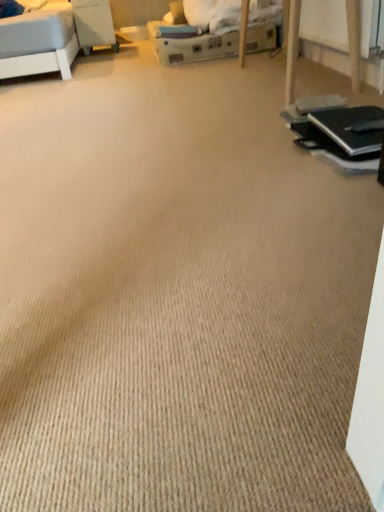
Question: Are wooden table at upper left and black matte laptop at right making contact?

Choices:
 (A) no
 (B) yes

Answer: (A)

Question: Considering the relative sizes of wooden table at upper left and black matte laptop at right in the image provided, is wooden table at upper left smaller than black matte laptop at right?

Choices:
 (A) yes
 (B) no

Answer: (B)

Question: Would you consider wooden table at upper left to be distant from black matte laptop at right?

Choices:
 (A) yes
 (B) no

Answer: (A)

Question: Is wooden table at upper left to the left of black matte laptop at right from the viewer's perspective?

Choices:
 (A) yes
 (B) no

Answer: (A)

Question: From a real-world perspective, does wooden table at upper left sit lower than black matte laptop at right?

Choices:
 (A) no
 (B) yes

Answer: (A)

Question: Is wooden table at upper left in front of black matte laptop at right?

Choices:
 (A) yes
 (B) no

Answer: (B)

Question: Does black matte laptop at right have a greater width compared to wooden table at upper left?

Choices:
 (A) yes
 (B) no

Answer: (B)

Question: From the image's perspective, is black matte laptop at right located beneath wooden table at upper left?

Choices:
 (A) yes
 (B) no

Answer: (A)

Question: From a real-world perspective, is black matte laptop at right on top of wooden table at upper left?

Choices:
 (A) no
 (B) yes

Answer: (A)

Question: Could wooden table at upper left be considered to be inside black matte laptop at right?

Choices:
 (A) yes
 (B) no

Answer: (B)

Question: Does black matte laptop at right have a larger size compared to wooden table at upper left?

Choices:
 (A) yes
 (B) no

Answer: (B)

Question: From a real-world perspective, is black matte laptop at right under wooden table at upper left?

Choices:
 (A) no
 (B) yes

Answer: (B)

Question: Looking at their shapes, would you say black matte laptop at right is wider or thinner than wooden table at upper left?

Choices:
 (A) wide
 (B) thin

Answer: (B)